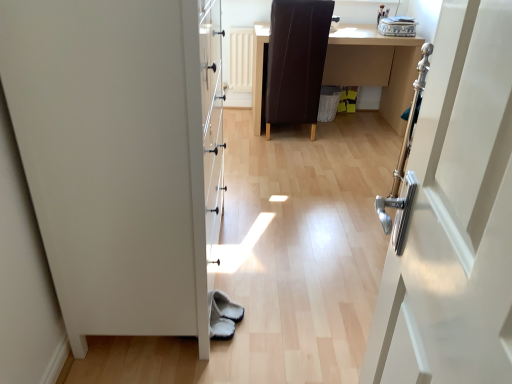
Where is `vacant area that is situated to the right of white matte door at left`? vacant area that is situated to the right of white matte door at left is located at coordinates (296, 262).